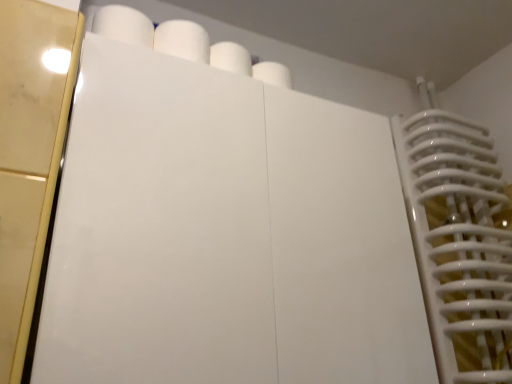
Locate an element on the screen. This screenshot has height=384, width=512. white glossy door at upper center is located at coordinates (160, 228).

Image resolution: width=512 pixels, height=384 pixels. What do you see at coordinates (160, 228) in the screenshot?
I see `white glossy door at upper center` at bounding box center [160, 228].

What do you see at coordinates (183, 40) in the screenshot? Image resolution: width=512 pixels, height=384 pixels. I see `white matte paper towel at upper center` at bounding box center [183, 40].

Where is `white matte paper towel at upper center`? white matte paper towel at upper center is located at coordinates (183, 40).

This screenshot has width=512, height=384. I want to click on white glossy door at upper center, so click(160, 228).

Considering the positions of objects white matte paper towel at upper center and white glossy door at upper center in the image provided, who is more to the left, white matte paper towel at upper center or white glossy door at upper center?

white matte paper towel at upper center.

Which object is more forward, white matte paper towel at upper center or white glossy door at upper center?

white glossy door at upper center is closer to the camera.

Between point (181, 31) and point (175, 293), which one is positioned behind?

Point (181, 31)

From the image's perspective, is white matte paper towel at upper center below white glossy door at upper center?

No, from the image's perspective, white matte paper towel at upper center is not beneath white glossy door at upper center.

Based on the photo, from a real-world perspective, which is physically below, white matte paper towel at upper center or white glossy door at upper center?

In real-world perspective, white glossy door at upper center is lower.

Considering the relative sizes of white matte paper towel at upper center and white glossy door at upper center in the image provided, is white matte paper towel at upper center thinner than white glossy door at upper center?

Yes, white matte paper towel at upper center is thinner than white glossy door at upper center.

Considering the sizes of white matte paper towel at upper center and white glossy door at upper center in the image, is white matte paper towel at upper center taller or shorter than white glossy door at upper center?

Clearly, white matte paper towel at upper center is shorter compared to white glossy door at upper center.

Which of these two, white matte paper towel at upper center or white glossy door at upper center, is bigger?

With larger size is white glossy door at upper center.

Is white matte paper towel at upper center inside the boundaries of white glossy door at upper center, or outside?

white matte paper towel at upper center is not inside white glossy door at upper center, it's outside.

Is white matte paper towel at upper center next to white glossy door at upper center?

There is a gap between white matte paper towel at upper center and white glossy door at upper center.

Does white matte paper towel at upper center turn towards white glossy door at upper center?

No.

How different are the orientations of white matte paper towel at upper center and white glossy door at upper center in degrees?

There is a 2.58-degree angle between the facing directions of white matte paper towel at upper center and white glossy door at upper center.

How far apart are white matte paper towel at upper center and white glossy door at upper center?

The distance of white matte paper towel at upper center from white glossy door at upper center is 11.00 inches.

Where is `door below the white matte paper towel at upper center (from a real-world perspective)`? Image resolution: width=512 pixels, height=384 pixels. door below the white matte paper towel at upper center (from a real-world perspective) is located at coordinates (160, 228).

Between white glossy door at upper center and white matte paper towel at upper center, which one appears on the left side from the viewer's perspective?

white matte paper towel at upper center is more to the left.

Is white glossy door at upper center closer to the viewer compared to white matte paper towel at upper center?

Yes, white glossy door at upper center is closer to the viewer.

Considering the points (256, 179) and (182, 47), which point is behind, point (256, 179) or point (182, 47)?

The point (182, 47) is behind.

From the image's perspective, which is below, white glossy door at upper center or white matte paper towel at upper center?

white glossy door at upper center, from the image's perspective.

From a real-world perspective, is white glossy door at upper center located beneath white matte paper towel at upper center?

Yes, from a real-world perspective, white glossy door at upper center is beneath white matte paper towel at upper center.

Consider the image. Between white glossy door at upper center and white matte paper towel at upper center, which one has larger width?

Wider between the two is white glossy door at upper center.

Who is shorter, white glossy door at upper center or white matte paper towel at upper center?

With less height is white matte paper towel at upper center.

Considering the sizes of objects white glossy door at upper center and white matte paper towel at upper center in the image provided, who is bigger, white glossy door at upper center or white matte paper towel at upper center?

Bigger between the two is white glossy door at upper center.

Is white matte paper towel at upper center a part of white glossy door at upper center?

No.

Is white glossy door at upper center beside white matte paper towel at upper center?

They are not placed beside each other.

Is white glossy door at upper center turned away from white matte paper towel at upper center?

white glossy door at upper center is not turned away from white matte paper towel at upper center.

How many degrees apart are the facing directions of white glossy door at upper center and white matte paper towel at upper center?

2.58 degrees separate the facing orientations of white glossy door at upper center and white matte paper towel at upper center.

Locate an element on the screen. door below the white matte paper towel at upper center (from a real-world perspective) is located at coordinates (160, 228).

The image size is (512, 384). I want to click on paper towel lying above the white glossy door at upper center (from the image's perspective), so [183, 40].

At what (x,y) coordinates should I click in order to perform the action: click on paper towel lying on the left of white glossy door at upper center. Please return your answer as a coordinate pair (x, y). The width and height of the screenshot is (512, 384). Looking at the image, I should click on coord(183,40).